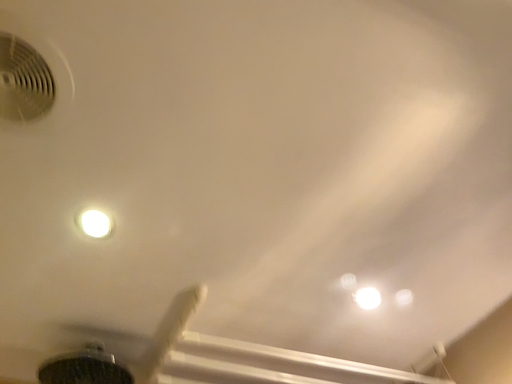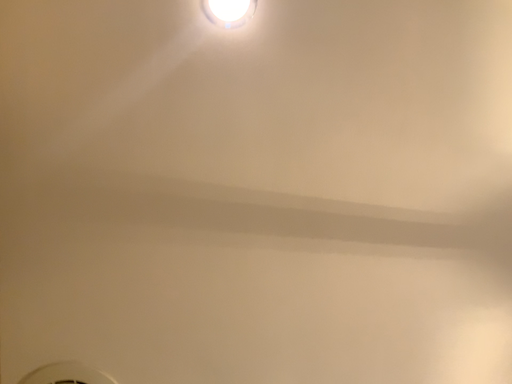
Question: How did the camera likely rotate when shooting the video?

Choices:
 (A) rotated right
 (B) rotated left

Answer: (B)